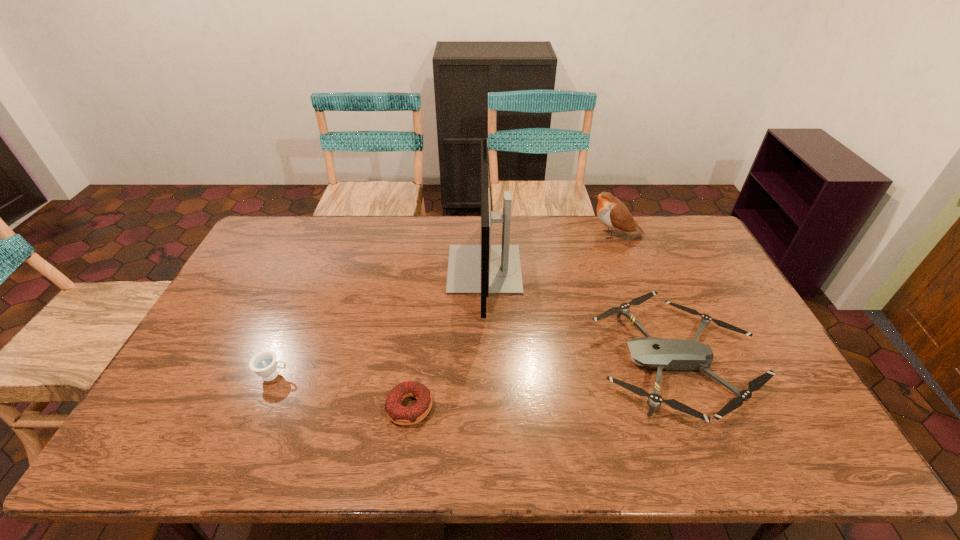
I want to click on drone at the near edge, so click(670, 354).

You are a GUI agent. You are given a task and a screenshot of the screen. Output one action in this format:
    pyautogui.click(x=<x>, y=<y>)
    Task: Click on the doughnut at the near edge
    This screenshot has width=960, height=540.
    Given the screenshot: What is the action you would take?
    pyautogui.click(x=396, y=412)

At what (x,y) coordinates should I click in order to perform the action: click on object that is at the right edge. Please return your answer as a coordinate pair (x, y). The width and height of the screenshot is (960, 540). Looking at the image, I should click on (670, 354).

At what (x,y) coordinates should I click in order to perform the action: click on object at the near right corner. Please return your answer as a coordinate pair (x, y). Looking at the image, I should click on (670, 354).

In the image, there is a desktop. Identify the location of free space at the far edge. The height and width of the screenshot is (540, 960). (589, 229).

Locate an element on the screen. vacant area at the left edge of the desktop is located at coordinates (208, 332).

This screenshot has width=960, height=540. Identify the location of vacant area at the right edge. (702, 282).

Image resolution: width=960 pixels, height=540 pixels. In order to click on unoccupied position between the computer monitor and the teacup in this screenshot , I will do `click(379, 322)`.

This screenshot has width=960, height=540. I want to click on blank region between the doughnut and the third object from left to right, so click(x=447, y=338).

This screenshot has width=960, height=540. I want to click on free space between the leftmost object and the bird, so click(444, 305).